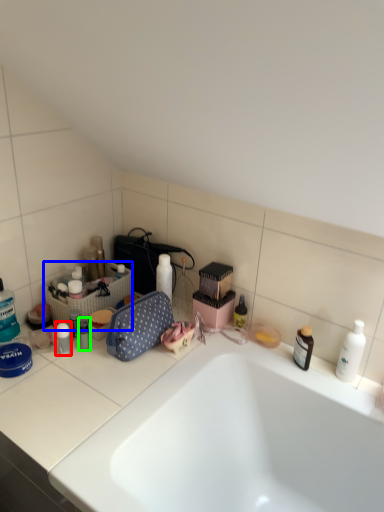
Question: Considering the real-world distances, which object is closest to toiletry (highlighted by a red box)? laundry basket (highlighted by a blue box) or toiletry (highlighted by a green box).

Choices:
 (A) laundry basket
 (B) toiletry

Answer: (B)